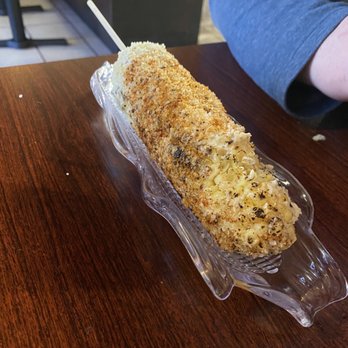
The image size is (348, 348). Find the location of `clear glass plate edge, lower right corner`. clear glass plate edge, lower right corner is located at coordinates point(305,278), point(219,275), point(295,207).